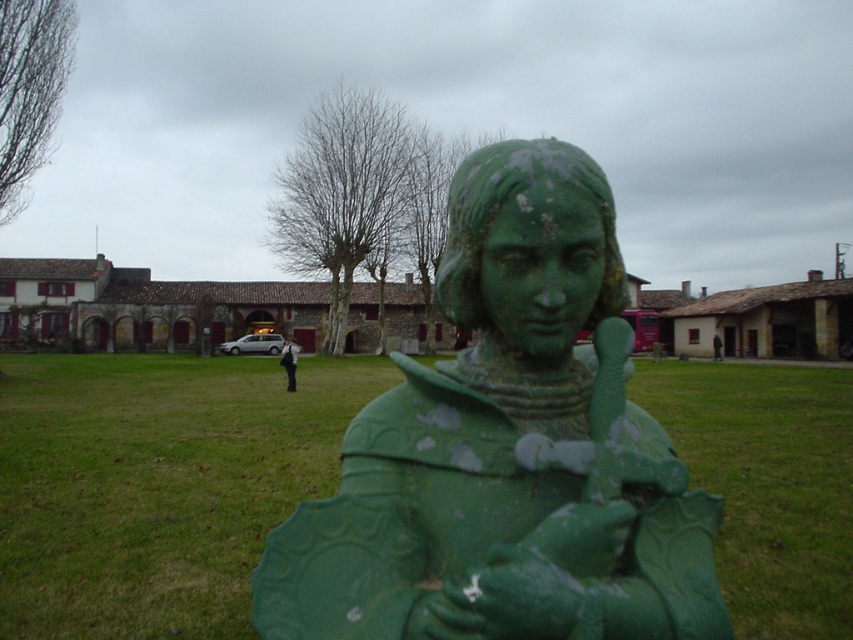
You are a visitor standing in front of the green patinated metal statue at center and the black fabric pants at center. Which object is taller?

The black fabric pants at center are taller than the green patinated metal statue at center.